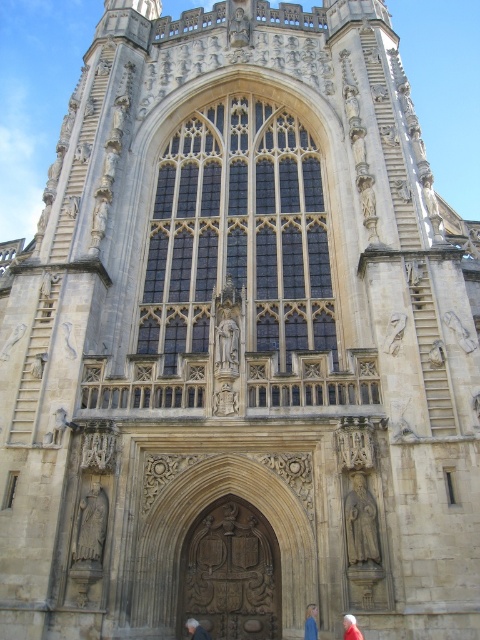
Who is lower down, red fabric person at lower right or light brown leather jacket at lower center?

light brown leather jacket at lower center is lower down.

Between red fabric person at lower right and light brown leather jacket at lower center, which one has more height?

red fabric person at lower right is taller.

Find the location of a particular element. The height and width of the screenshot is (640, 480). red fabric person at lower right is located at coordinates (350, 627).

Is the position of carved stone door at center less distant than that of red fabric person at lower right?

No, it is behind red fabric person at lower right.

Between carved stone door at center and red fabric person at lower right, which one has less height?

red fabric person at lower right is shorter.

Is point (192, 561) positioned behind point (351, 621)?

Yes.

This screenshot has width=480, height=640. What are the coordinates of `carved stone door at center` in the screenshot? It's located at tap(231, 573).

Consider the image. Which of these two, blonde hair at lower center or red fabric person at lower right, stands shorter?

red fabric person at lower right is shorter.

Consider the image. Can you confirm if blonde hair at lower center is positioned above red fabric person at lower right?

No.

Is point (307, 628) positioned behind point (355, 634)?

That is True.

I want to click on blonde hair at lower center, so click(311, 621).